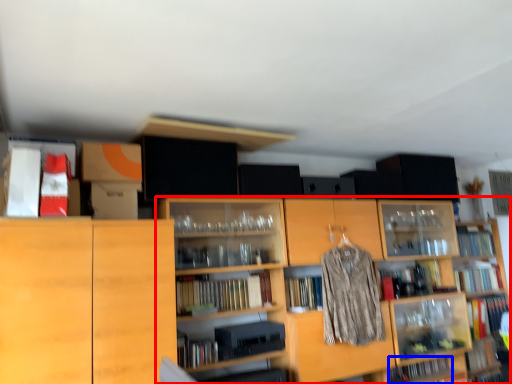
Question: Which point is further to the camera, shelf (highlighted by a red box) or book (highlighted by a blue box)?

Choices:
 (A) shelf
 (B) book

Answer: (B)